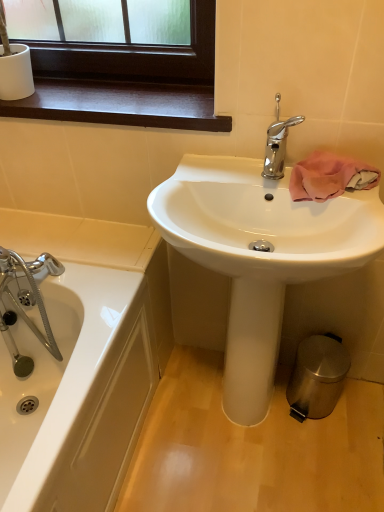
I want to click on free space between white glossy sink at center and polished stainless steel trash can at lower right, so click(332, 434).